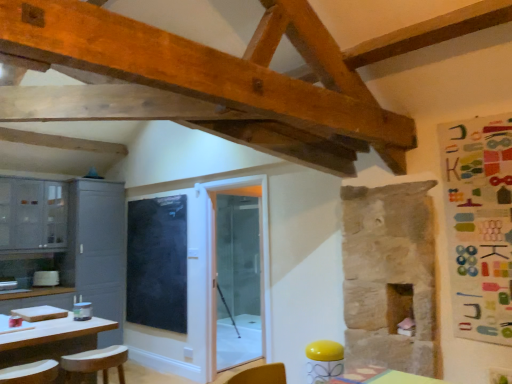
Question: Is matte gray cabinets at left, which ranks as the first cabinetry in left-to-right order, positioned behind transparent glass door at center?

Choices:
 (A) yes
 (B) no

Answer: (A)

Question: Is matte gray cabinets at left, which ranks as the first cabinetry in left-to-right order, taller than transparent glass door at center?

Choices:
 (A) yes
 (B) no

Answer: (B)

Question: Is matte gray cabinets at left, which ranks as the first cabinetry in left-to-right order, smaller than transparent glass door at center?

Choices:
 (A) no
 (B) yes

Answer: (A)

Question: Is transparent glass door at center completely or partially inside matte gray cabinets at left, which ranks as the first cabinetry in left-to-right order?

Choices:
 (A) no
 (B) yes

Answer: (A)

Question: From the image's perspective, does matte gray cabinets at left, which ranks as the first cabinetry in left-to-right order, appear lower than transparent glass door at center?

Choices:
 (A) yes
 (B) no

Answer: (B)

Question: Would you say black matte chalkboard at center is to the left or to the right of matte gray cabinet at left, the second cabinetry in the left-to-right sequence, in the picture?

Choices:
 (A) left
 (B) right

Answer: (B)

Question: Considering the positions of point (140, 264) and point (68, 243), is point (140, 264) closer or farther from the camera than point (68, 243)?

Choices:
 (A) closer
 (B) farther

Answer: (A)

Question: From a real-world perspective, relative to matte gray cabinet at left, the second cabinetry in the left-to-right sequence, is black matte chalkboard at center vertically above or below?

Choices:
 (A) below
 (B) above

Answer: (B)

Question: Is black matte chalkboard at center in front of or behind matte gray cabinet at left, acting as the 1th cabinetry starting from the right, in the image?

Choices:
 (A) behind
 (B) front

Answer: (B)

Question: Considering the positions of matte gray cabinet at left, acting as the 1th cabinetry starting from the right, and wooden stool at lower left in the image, is matte gray cabinet at left, acting as the 1th cabinetry starting from the right, wider or thinner than wooden stool at lower left?

Choices:
 (A) wide
 (B) thin

Answer: (A)

Question: Is matte gray cabinet at left, acting as the 1th cabinetry starting from the right, to the left or to the right of wooden stool at lower left in the image?

Choices:
 (A) left
 (B) right

Answer: (A)

Question: Does point (79, 258) appear closer or farther from the camera than point (65, 355)?

Choices:
 (A) closer
 (B) farther

Answer: (B)

Question: From a real-world perspective, relative to wooden stool at lower left, is matte gray cabinet at left, the second cabinetry in the left-to-right sequence, vertically above or below?

Choices:
 (A) below
 (B) above

Answer: (B)

Question: In the image, is matte gray cabinet at left, the second cabinetry in the left-to-right sequence, on the left side or the right side of matte gray cabinets at left, which ranks as the first cabinetry in left-to-right order?

Choices:
 (A) left
 (B) right

Answer: (B)

Question: From a real-world perspective, is matte gray cabinet at left, the second cabinetry in the left-to-right sequence, above or below matte gray cabinets at left, which ranks as the first cabinetry in left-to-right order?

Choices:
 (A) above
 (B) below

Answer: (B)